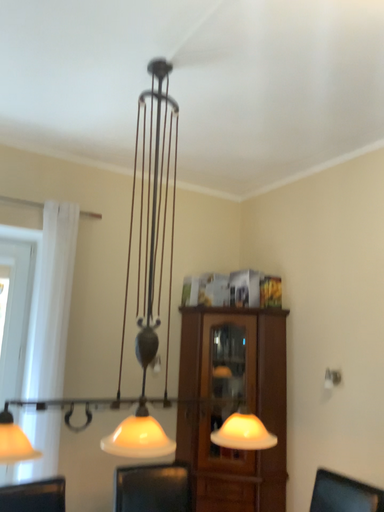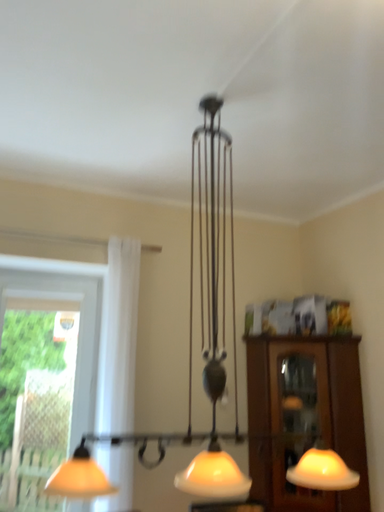
Question: How did the camera likely rotate when shooting the video?

Choices:
 (A) rotated left
 (B) rotated right

Answer: (A)